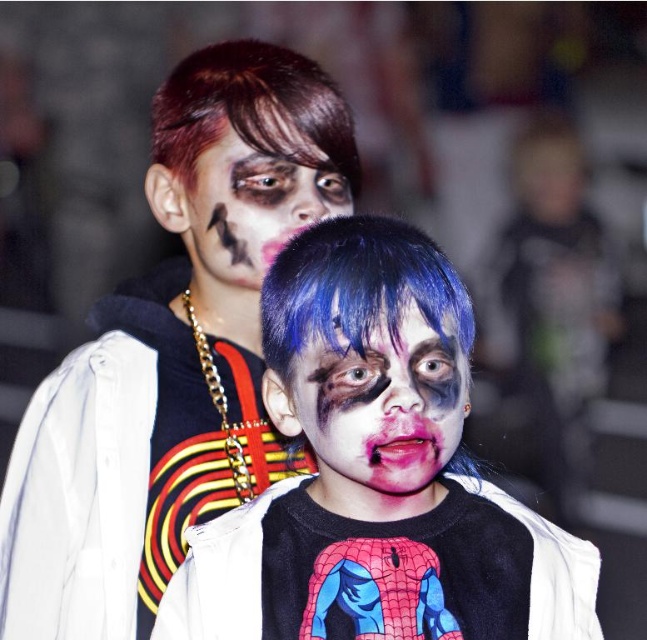
Question: Does matte black face paint at center appear on the right side of matte black face paint at upper center?

Choices:
 (A) yes
 (B) no

Answer: (A)

Question: Which of the following is the farthest from the observer?

Choices:
 (A) (212, 236)
 (B) (243, 227)

Answer: (A)

Question: Is spiderman t-shirt at center positioned in front of matte black face paint at upper center?

Choices:
 (A) yes
 (B) no

Answer: (A)

Question: Which point is closer to the camera taking this photo?

Choices:
 (A) (226, 627)
 (B) (419, 481)
 (C) (369, 312)
 (D) (254, 314)

Answer: (C)

Question: Based on their relative distances, which object is farther from the matte black face paint at center?

Choices:
 (A) matte black face paint at upper center
 (B) spiderman t-shirt at center
 (C) matte black shirt at center

Answer: (A)

Question: Can you confirm if matte black hoodie at upper center is positioned to the left of matte black face paint at upper center?

Choices:
 (A) no
 (B) yes

Answer: (B)